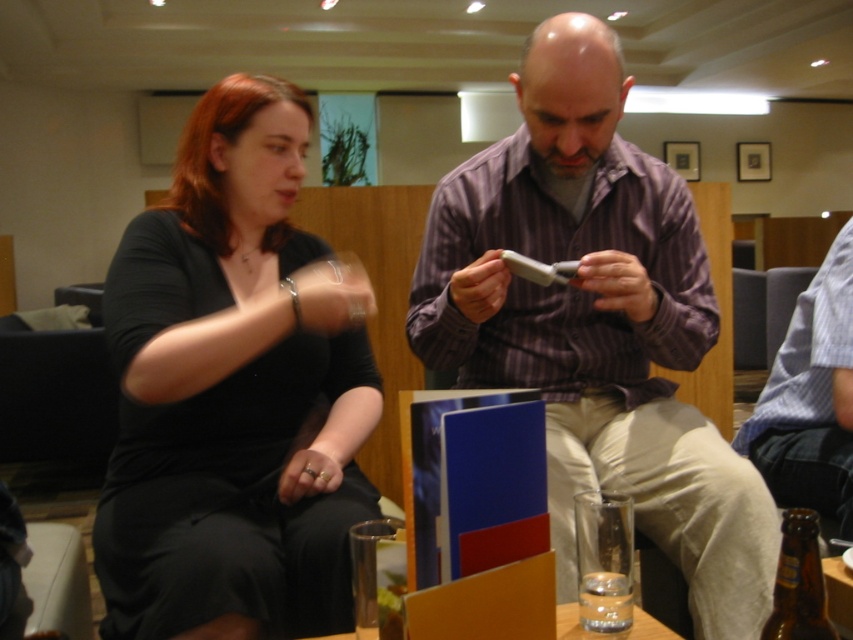
You are standing in the lounge and want to place a small object on the table. The table is at coordinates 0.6, 0.3. Where should you place the object relative to the black matte shirt at upper left?

The black matte shirt at upper left is located at point (x=233, y=392). Since the table is at coordinates (x=254, y=384), the object should be placed slightly to the right and above the black matte shirt at upper left to align with the table.

You are a delivery robot that needs to place a small package between the black matte shirt at upper left and the brown glass bottle at lower right. The package is 10 inches long. Can you fit it in the space between them?

The black matte shirt at upper left is 29.68 inches from the brown glass bottle at lower right, so yes, the package can fit in the space between them since it is shorter than the distance between the two objects.